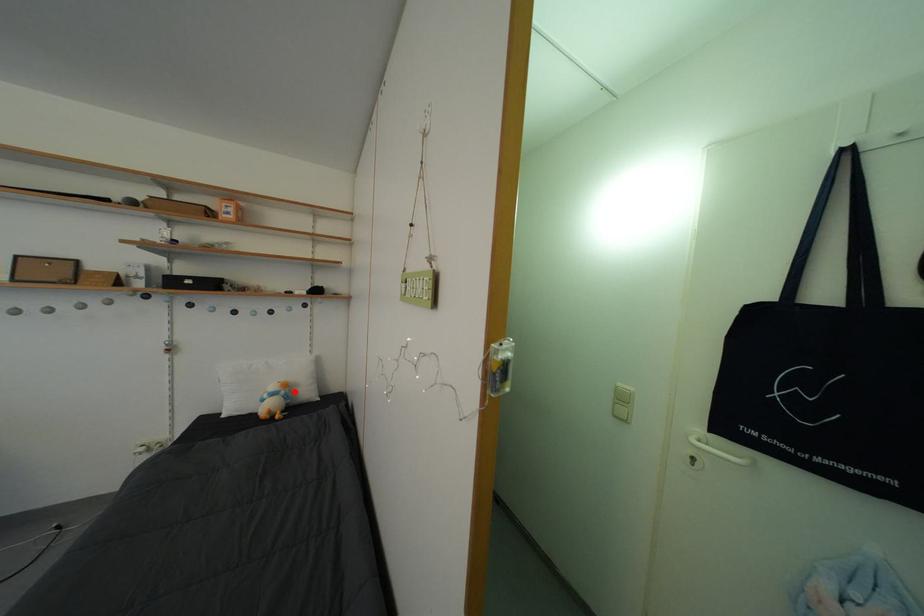
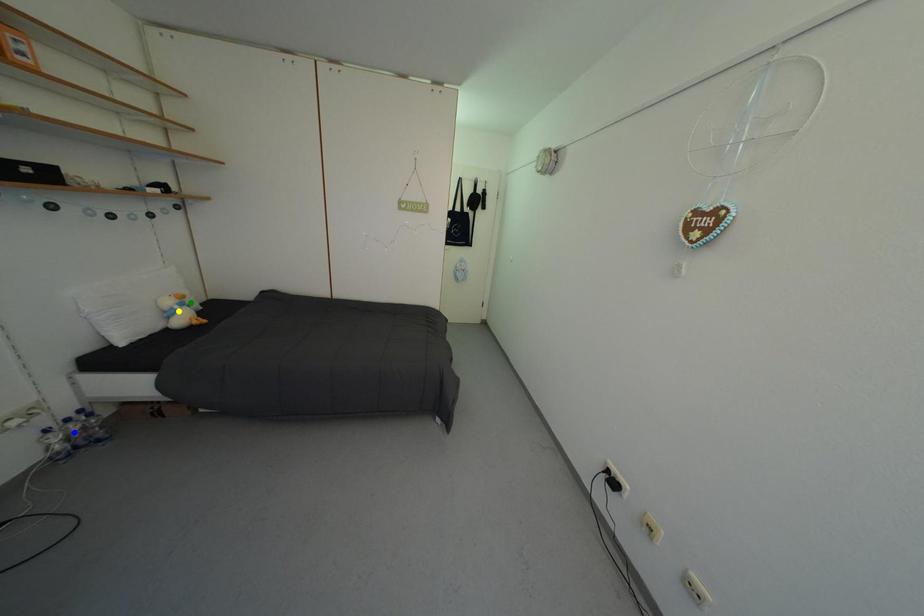
Question: I am providing you with two images of the same scene from different viewpoints. A red point is marked on the first image. You are given multiple points on the second image. Which spot in image 2 lines up with the point in image 1?

Choices:
 (A) green point
 (B) yellow point
 (C) blue point

Answer: (A)